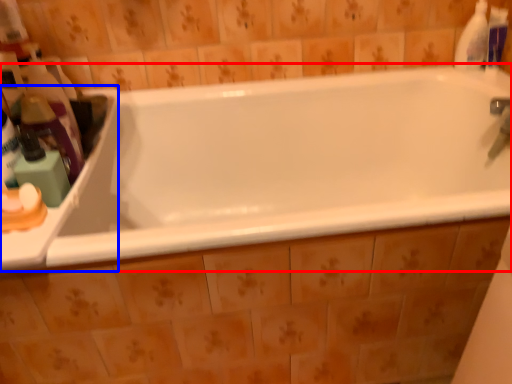
Question: Which of the following is the farthest to the observer, bathtub (highlighted by a red box) or counter top (highlighted by a blue box)?

Choices:
 (A) bathtub
 (B) counter top

Answer: (A)